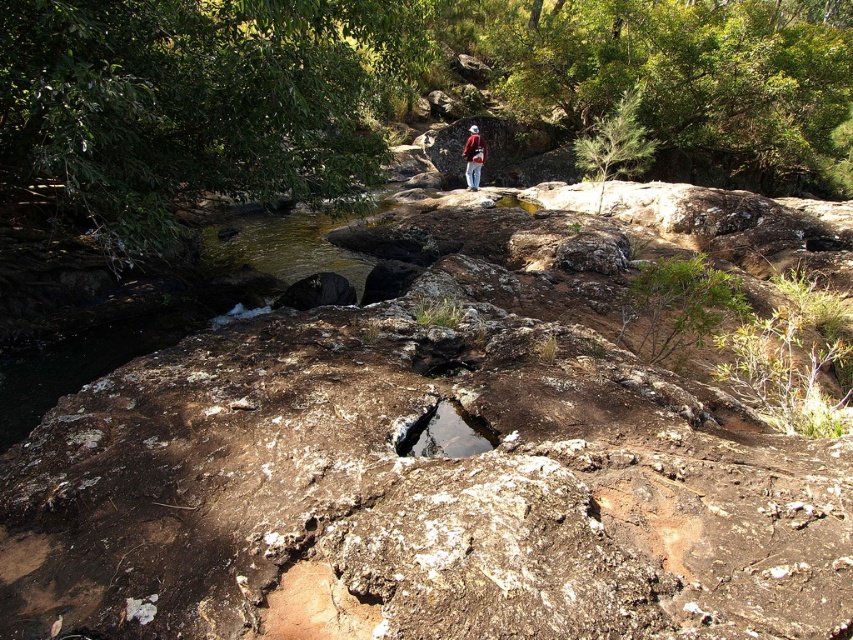
Question: Among these objects, which one is farthest from the camera?

Choices:
 (A) red woolen jacket at center
 (B) brown rock at center

Answer: (A)

Question: Is brown rough rock at center smaller than brown rock at center?

Choices:
 (A) no
 (B) yes

Answer: (A)

Question: Considering the relative positions of brown rough rock at center and red woolen jacket at center in the image provided, where is brown rough rock at center located with respect to red woolen jacket at center?

Choices:
 (A) above
 (B) below

Answer: (B)

Question: Among these points, which one is farthest from the camera?

Choices:
 (A) (415, 508)
 (B) (480, 138)

Answer: (B)

Question: Which point is closer to the camera taking this photo?

Choices:
 (A) (473, 134)
 (B) (21, 387)

Answer: (B)

Question: Does brown rough rock at center appear on the right side of red woolen jacket at center?

Choices:
 (A) yes
 (B) no

Answer: (B)